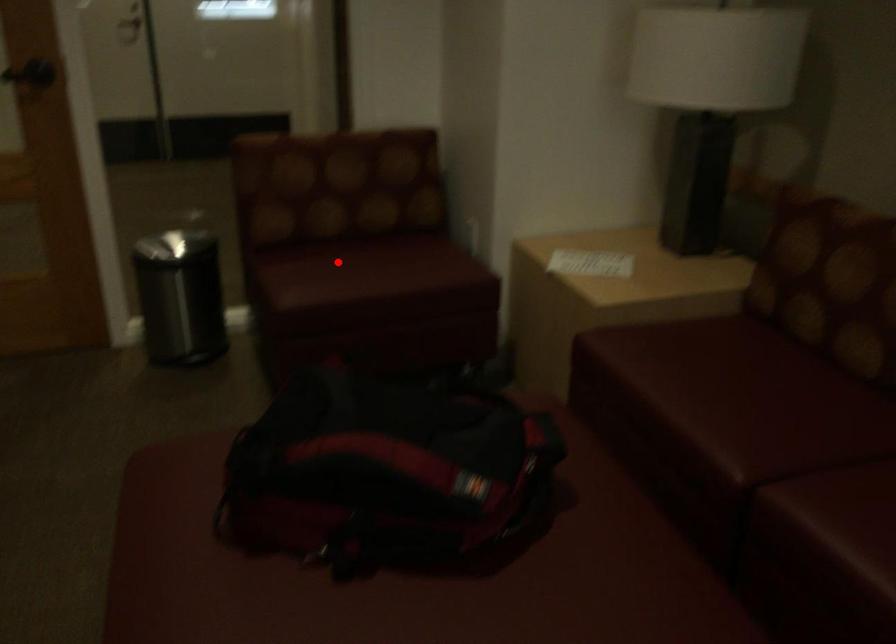
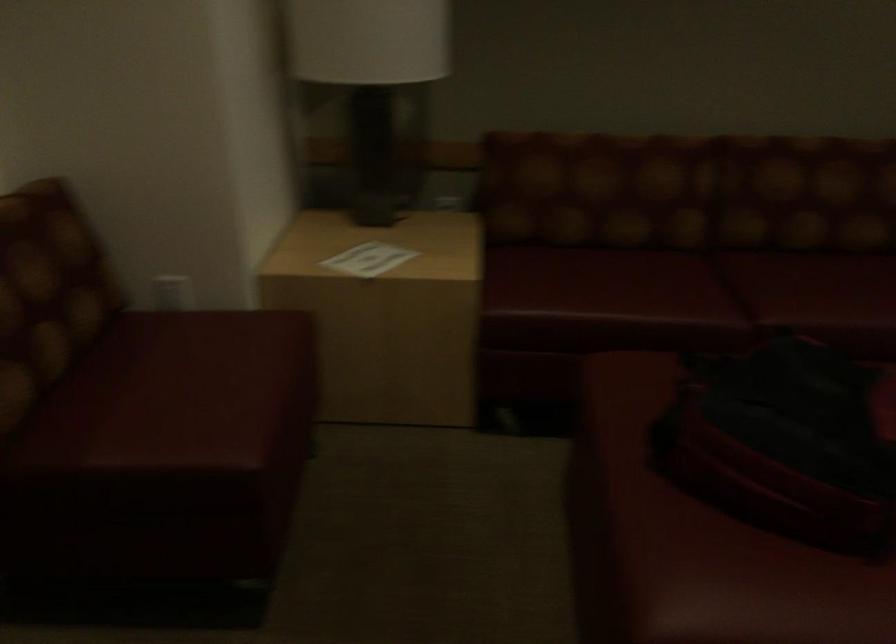
Question: I am providing you with two images of the same scene from different viewpoints. Image1 has a red point marked. In image2, the corresponding 3D location appears at what relative position? Reply with the corresponding letter.

Choices:
 (A) Closer
 (B) Farther

Answer: (A)